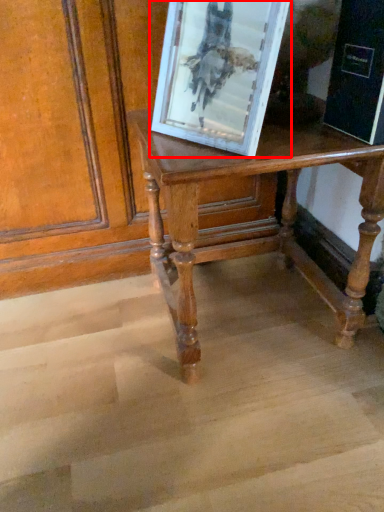
Question: Considering the relative positions of picture frame (annotated by the red box) and table in the image provided, where is picture frame (annotated by the red box) located with respect to the staircase?

Choices:
 (A) right
 (B) left

Answer: (B)